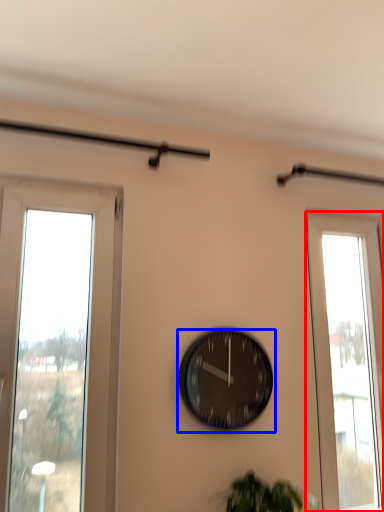
Question: Among these objects, which one is nearest to the camera, window (highlighted by a red box) or wall clock (highlighted by a blue box)?

Choices:
 (A) window
 (B) wall clock

Answer: (B)